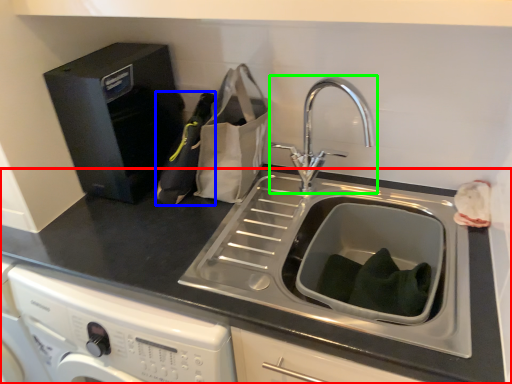
Question: Which object is positioned closest to countertop (highlighted by a red box)? Select from bottle (highlighted by a blue box) and tap (highlighted by a green box).

Choices:
 (A) bottle
 (B) tap

Answer: (A)